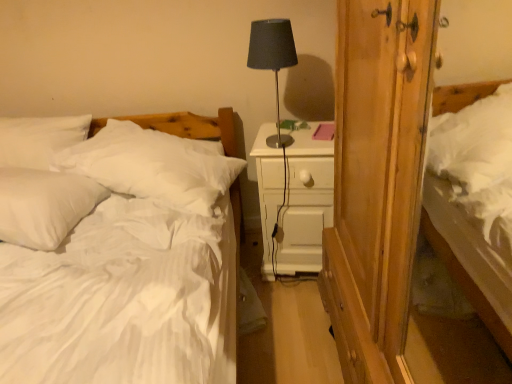
Question: Is matte black lamp at center inside the boundaries of white soft bed at left, or outside?

Choices:
 (A) outside
 (B) inside

Answer: (A)

Question: Is matte black lamp at center taller or shorter than white soft bed at left?

Choices:
 (A) short
 (B) tall

Answer: (A)

Question: Estimate the real-world distances between objects in this image. Which object is closer to the white wood nightstand at center?

Choices:
 (A) matte black lamp at center
 (B) white soft pillow at left, the 1th pillow from the right
 (C) wooden wardrobe at right
 (D) white soft bed at left
 (E) white soft pillow at left, positioned as the 2th pillow in right-to-left order

Answer: (C)

Question: Which of these objects is positioned farthest from the wooden wardrobe at right?

Choices:
 (A) white soft bed at left
 (B) white soft pillow at left, positioned as the 2th pillow in right-to-left order
 (C) white wood nightstand at center
 (D) white soft pillow at left, the 1th pillow from the right
 (E) matte black lamp at center

Answer: (B)